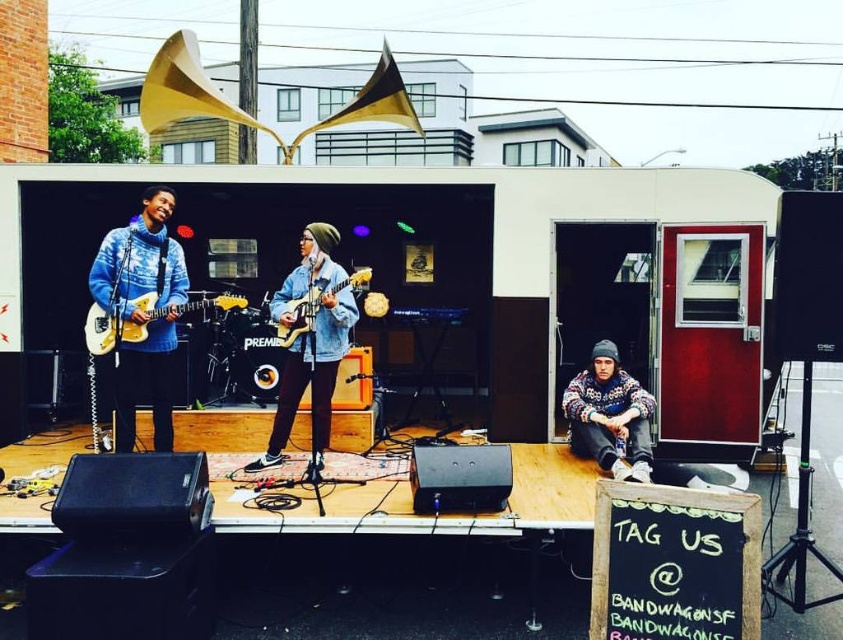
Between knitted sweater at lower right and matte electric guitar at left, which one is positioned higher?

matte electric guitar at left is higher up.

Does knitted sweater at lower right have a smaller size compared to matte electric guitar at left?

No.

Is point (631, 458) positioned behind point (208, 304)?

Yes, point (631, 458) is farther from viewer.

At what (x,y) coordinates should I click in order to perform the action: click on knitted sweater at lower right. Please return your answer as a coordinate pair (x, y). Looking at the image, I should click on (609, 417).

Is matte electric guitar at left thinner than matte blue electric guitar at center?

No, matte electric guitar at left is not thinner than matte blue electric guitar at center.

Is matte electric guitar at left positioned before matte blue electric guitar at center?

Answer: No.

Who is more distant from viewer, (x=106, y=342) or (x=305, y=307)?

Positioned behind is point (x=106, y=342).

Locate an element on the screen. The width and height of the screenshot is (843, 640). matte electric guitar at left is located at coordinates (143, 320).

Who is more distant from viewer, (345,275) or (219,301)?

The point (345,275) is more distant.

Which is in front, point (267, 461) or point (103, 310)?

Point (103, 310) is in front.

This screenshot has width=843, height=640. I want to click on denim jacket at center, so point(307,340).